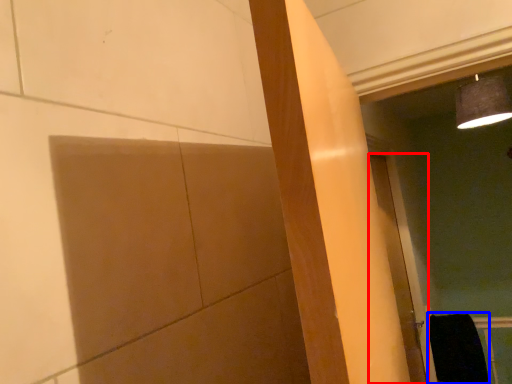
Question: Which of the following is the closest to the observer, door (highlighted by a red box) or material (highlighted by a blue box)?

Choices:
 (A) door
 (B) material

Answer: (A)